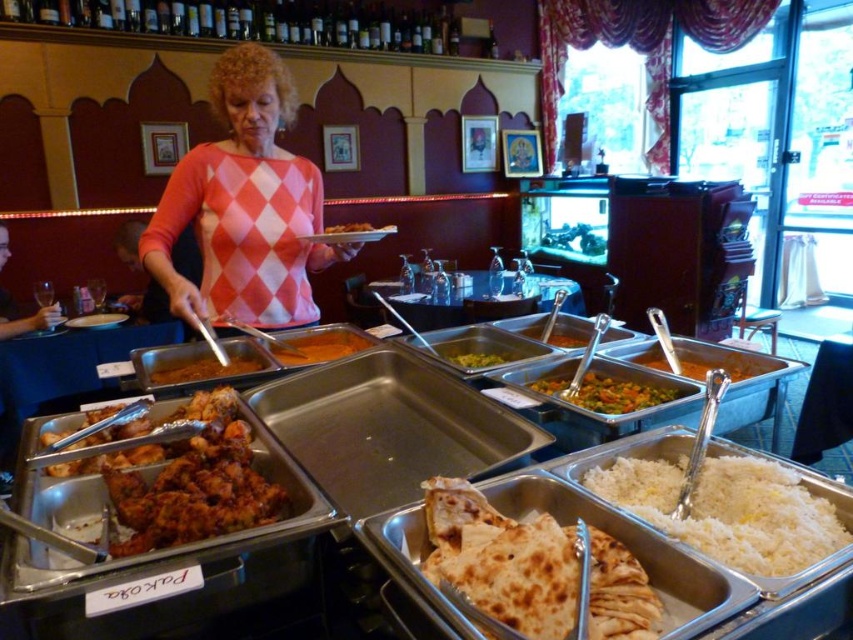
Question: Is golden brown flatbread at center to the left of brown matte chicken at center from the viewer's perspective?

Choices:
 (A) no
 (B) yes

Answer: (A)

Question: Among these objects, which one is farthest from the camera?

Choices:
 (A) brown matte chicken at center
 (B) orange smoothie at center
 (C) multicolored vegetables at center
 (D) yellowish-green sauce at center

Answer: (A)

Question: Which point is closer to the camera taking this photo?

Choices:
 (A) (628, 392)
 (B) (178, 500)
 (C) (457, 362)
 (D) (366, 337)

Answer: (B)

Question: Which object is closer to the camera taking this photo?

Choices:
 (A) multicolored vegetables at center
 (B) golden brown flatbread at center

Answer: (B)

Question: Can you confirm if golden brown flatbread at center is smaller than multicolored vegetables at center?

Choices:
 (A) no
 (B) yes

Answer: (A)

Question: From the image, what is the correct spatial relationship of golden brown flatbread at center in relation to multicolored vegetables at center?

Choices:
 (A) above
 (B) below

Answer: (B)